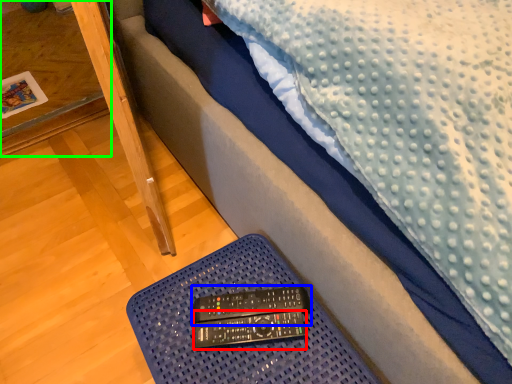
Question: Based on their relative distances, which object is nearer to control (highlighted by a red box)? Choose from control (highlighted by a blue box) and table (highlighted by a green box).

Choices:
 (A) control
 (B) table

Answer: (A)